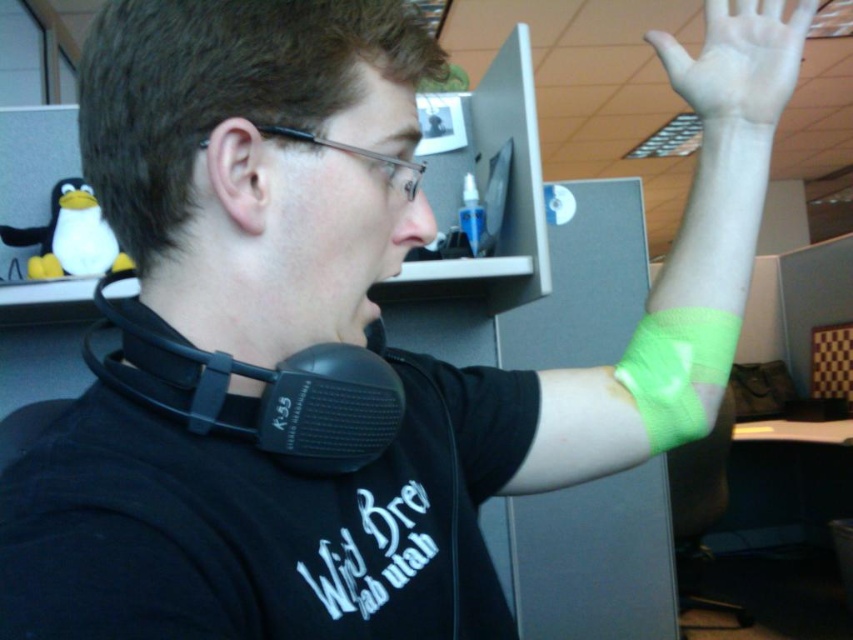
Consider the image. Is green fabric wristband at upper right in front of neon green mesh wristband at upper right?

Yes.

Who is more distant from viewer, (560, 416) or (714, 355)?

The point (560, 416) is more distant.

In order to click on green fabric wristband at upper right in this screenshot , I will do `click(683, 259)`.

The height and width of the screenshot is (640, 853). Identify the location of green fabric wristband at upper right. (683, 259).

Is point (715, 289) positioned behind point (660, 32)?

No, it is not.

Can you confirm if green fabric wristband at upper right is shorter than green fabric bandage at upper right?

In fact, green fabric wristband at upper right may be taller than green fabric bandage at upper right.

Image resolution: width=853 pixels, height=640 pixels. What do you see at coordinates (683, 259) in the screenshot?
I see `green fabric wristband at upper right` at bounding box center [683, 259].

The height and width of the screenshot is (640, 853). In order to click on green fabric wristband at upper right in this screenshot , I will do `click(683, 259)`.

Which is more to the left, neon green mesh wristband at upper right or black matte headphones at center?

From the viewer's perspective, black matte headphones at center appears more on the left side.

At what (x,y) coordinates should I click in order to perform the action: click on neon green mesh wristband at upper right. Please return your answer as a coordinate pair (x, y). This screenshot has width=853, height=640. Looking at the image, I should click on (677, 371).